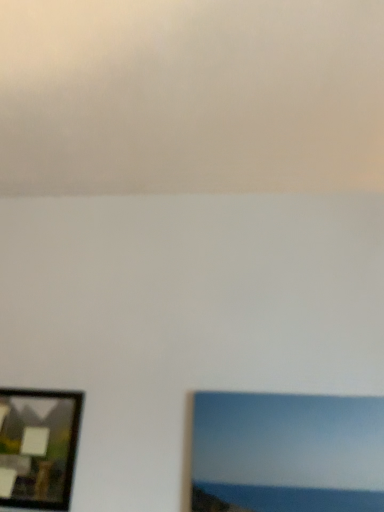
Question: Is matte blue picture frame at lower right, positioned as the second picture frame in left-to-right order, placed right next to matte black picture frame at lower left, positioned as the 2th picture frame in right-to-left order?

Choices:
 (A) yes
 (B) no

Answer: (B)

Question: From a real-world perspective, is matte blue picture frame at lower right, positioned as the second picture frame in left-to-right order, below matte black picture frame at lower left, positioned as the 2th picture frame in right-to-left order?

Choices:
 (A) yes
 (B) no

Answer: (B)

Question: From a real-world perspective, is matte blue picture frame at lower right, positioned as the second picture frame in left-to-right order, on top of matte black picture frame at lower left, positioned as the 2th picture frame in right-to-left order?

Choices:
 (A) yes
 (B) no

Answer: (A)

Question: Is matte blue picture frame at lower right, the 1th picture frame viewed from the right, wider than matte black picture frame at lower left, positioned as the 2th picture frame in right-to-left order?

Choices:
 (A) no
 (B) yes

Answer: (B)

Question: Is matte blue picture frame at lower right, the 1th picture frame viewed from the right, at the right side of matte black picture frame at lower left, positioned as the 2th picture frame in right-to-left order?

Choices:
 (A) yes
 (B) no

Answer: (A)

Question: Is matte blue picture frame at lower right, positioned as the second picture frame in left-to-right order, behind matte black picture frame at lower left, which is counted as the 1th picture frame, starting from the left?

Choices:
 (A) no
 (B) yes

Answer: (A)

Question: Is matte black picture frame at lower left, positioned as the 2th picture frame in right-to-left order, shorter than matte blue picture frame at lower right, positioned as the second picture frame in left-to-right order?

Choices:
 (A) no
 (B) yes

Answer: (A)

Question: From the image's perspective, does matte black picture frame at lower left, positioned as the 2th picture frame in right-to-left order, appear lower than matte blue picture frame at lower right, positioned as the second picture frame in left-to-right order?

Choices:
 (A) no
 (B) yes

Answer: (B)

Question: Considering the relative sizes of matte black picture frame at lower left, which is counted as the 1th picture frame, starting from the left, and matte blue picture frame at lower right, the 1th picture frame viewed from the right, in the image provided, is matte black picture frame at lower left, which is counted as the 1th picture frame, starting from the left, bigger than matte blue picture frame at lower right, the 1th picture frame viewed from the right,?

Choices:
 (A) yes
 (B) no

Answer: (B)

Question: Is matte black picture frame at lower left, positioned as the 2th picture frame in right-to-left order, not within matte blue picture frame at lower right, positioned as the second picture frame in left-to-right order?

Choices:
 (A) yes
 (B) no

Answer: (A)

Question: Considering the relative sizes of matte black picture frame at lower left, which is counted as the 1th picture frame, starting from the left, and matte blue picture frame at lower right, positioned as the second picture frame in left-to-right order, in the image provided, is matte black picture frame at lower left, which is counted as the 1th picture frame, starting from the left, smaller than matte blue picture frame at lower right, positioned as the second picture frame in left-to-right order,?

Choices:
 (A) no
 (B) yes

Answer: (B)

Question: Considering the relative positions of matte black picture frame at lower left, positioned as the 2th picture frame in right-to-left order, and matte blue picture frame at lower right, the 1th picture frame viewed from the right, in the image provided, is matte black picture frame at lower left, positioned as the 2th picture frame in right-to-left order, to the left of matte blue picture frame at lower right, the 1th picture frame viewed from the right, from the viewer's perspective?

Choices:
 (A) no
 (B) yes

Answer: (B)

Question: From a real-world perspective, is matte blue picture frame at lower right, positioned as the second picture frame in left-to-right order, above or below matte black picture frame at lower left, positioned as the 2th picture frame in right-to-left order?

Choices:
 (A) below
 (B) above

Answer: (B)